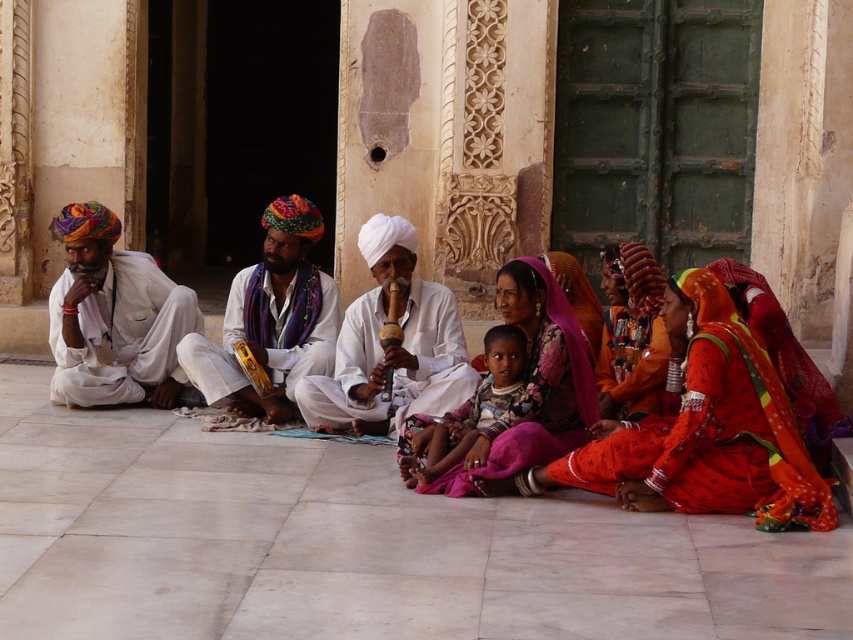
Looking at this image, can you confirm if matte white clothing at center is wider than white matte turban at center?

Yes.

Which is above, matte white clothing at center or white matte turban at center?

white matte turban at center is above.

Is point (636, 456) less distant than point (306, 406)?

Yes.

At what (x,y) coordinates should I click in order to perform the action: click on matte white clothing at center. Please return your answer as a coordinate pair (x, y). Looking at the image, I should click on (660, 420).

Can you confirm if matte white clothing at center is positioned below pink satin saree at center?

Indeed, matte white clothing at center is positioned under pink satin saree at center.

Which is in front, point (787, 456) or point (426, 490)?

Point (787, 456) is more forward.

This screenshot has height=640, width=853. What are the coordinates of `matte white clothing at center` in the screenshot? It's located at (660, 420).

Can you confirm if white matte turban at center is shorter than floral fabric child at center?

In fact, white matte turban at center may be taller than floral fabric child at center.

Is white matte turban at center closer to the viewer compared to floral fabric child at center?

That is False.

Is point (335, 372) closer to viewer compared to point (503, 332)?

No.

Find the location of `white matte turban at center`. white matte turban at center is located at coordinates (392, 346).